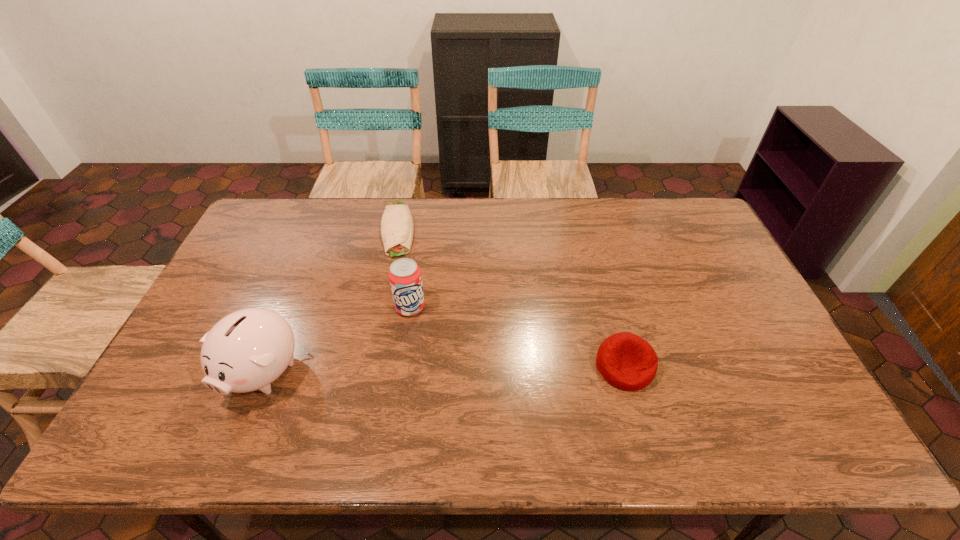
Where is `the leftmost object`? The height and width of the screenshot is (540, 960). the leftmost object is located at coordinates (247, 350).

Identify the location of the tallest object. (247, 350).

Locate an element on the screen. The image size is (960, 540). the rightmost object is located at coordinates (625, 360).

The height and width of the screenshot is (540, 960). Find the location of `the third tallest object`. the third tallest object is located at coordinates (625, 360).

Where is `burrito`? Image resolution: width=960 pixels, height=540 pixels. burrito is located at coordinates (397, 227).

The width and height of the screenshot is (960, 540). Identify the location of the farthest object. (397, 227).

Identify the location of the second tallest object. Image resolution: width=960 pixels, height=540 pixels. (405, 279).

Image resolution: width=960 pixels, height=540 pixels. In order to click on the third nearest object in this screenshot , I will do `click(405, 279)`.

At what (x,y) coordinates should I click in order to perform the action: click on free space located on the left of the tallest object. Please return your answer as a coordinate pair (x, y). The width and height of the screenshot is (960, 540). Looking at the image, I should click on (185, 371).

Identify the location of vacant space located 0.330m at the bitten end of the burrito. (395, 339).